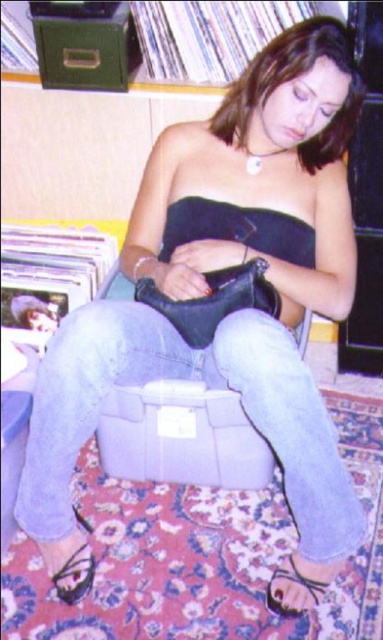
Measure the distance between point (304, 420) and camera.

Point (304, 420) and camera are 3.56 feet apart from each other.

Does denim jeans at center have a lesser height compared to black leather sandal at lower center?

No.

What are the coordinates of `denim jeans at center` in the screenshot? It's located at (186, 378).

You are a GUI agent. You are given a task and a screenshot of the screen. Output one action in this format:
    pyautogui.click(x=<x>, y=<y>)
    Task: Click on the denim jeans at center
    
    Given the screenshot: What is the action you would take?
    pyautogui.click(x=186, y=378)

Can you confirm if black leather sandal at lower left is positioned to the left of black leather sandal at lower center?

Yes, black leather sandal at lower left is to the left of black leather sandal at lower center.

Between black leather sandal at lower left and black leather sandal at lower center, which one has more height?

With more height is black leather sandal at lower left.

This screenshot has width=383, height=640. Find the location of `black leather sandal at lower left`. black leather sandal at lower left is located at coordinates (70, 564).

Locate an element on the screen. The height and width of the screenshot is (640, 383). denim jeans at center is located at coordinates (186, 378).

Measure the distance between denim jeans at center and camera.

The distance of denim jeans at center from camera is 1.04 meters.

Identify the location of denim jeans at center. The image size is (383, 640). (186, 378).